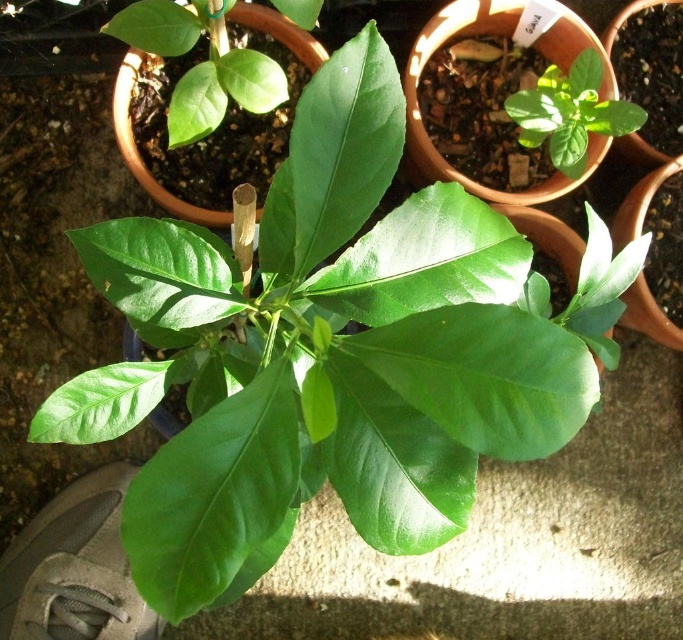
Question: Is glossy green leaf at upper left below green matte leaf at upper right?

Choices:
 (A) no
 (B) yes

Answer: (B)

Question: Is glossy green leaf at upper left closer to the viewer compared to green matte leaf at upper right?

Choices:
 (A) yes
 (B) no

Answer: (A)

Question: Which of the following is the closest to the observer?

Choices:
 (A) (186, 131)
 (B) (548, 140)

Answer: (A)

Question: Which point is closer to the camera?

Choices:
 (A) green matte leaf at upper right
 (B) glossy green leaf at upper left

Answer: (B)

Question: Does glossy green leaf at upper left have a lesser width compared to green matte leaf at upper right?

Choices:
 (A) no
 (B) yes

Answer: (A)